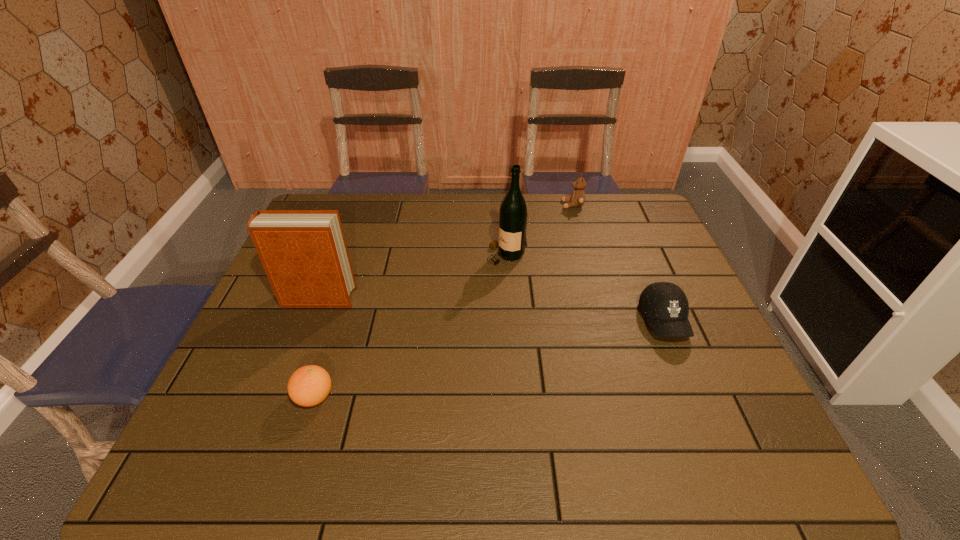
The width and height of the screenshot is (960, 540). I want to click on free space that satisfies the following two spatial constraints: 1. on the open cover of the nearest object; 2. on the left side of the hardback book, so click(x=280, y=397).